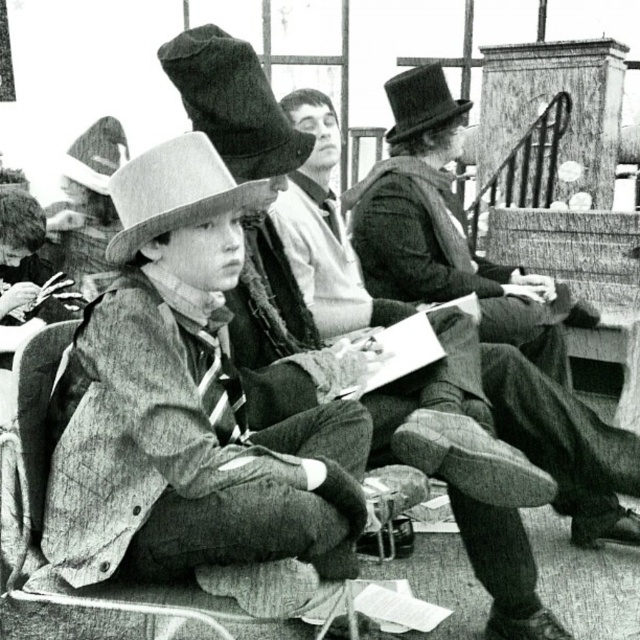
Question: Does soft felt dress hat at upper center come behind wooden chair at center?

Choices:
 (A) no
 (B) yes

Answer: (B)

Question: Can you confirm if wooden chair at center is positioned to the left of black felt dress hat at upper right?

Choices:
 (A) yes
 (B) no

Answer: (A)

Question: In this image, where is matte gray dress hat at center located relative to wooden chair at center?

Choices:
 (A) left
 (B) right

Answer: (A)

Question: Which point is farther to the camera?

Choices:
 (A) (385, 140)
 (B) (294, 228)

Answer: (A)

Question: Which object appears closest to the camera in this image?

Choices:
 (A) wooden chair at center
 (B) soft felt dress hat at upper center
 (C) smooth black coat at center
 (D) matte gray dress hat at upper left

Answer: (A)

Question: Estimate the real-world distances between objects in this image. Which object is closer to the matte gray dress hat at upper left?

Choices:
 (A) smooth black coat at center
 (B) matte gray dress hat at center
 (C) wooden chair at center
 (D) soft felt dress hat at upper center

Answer: (A)